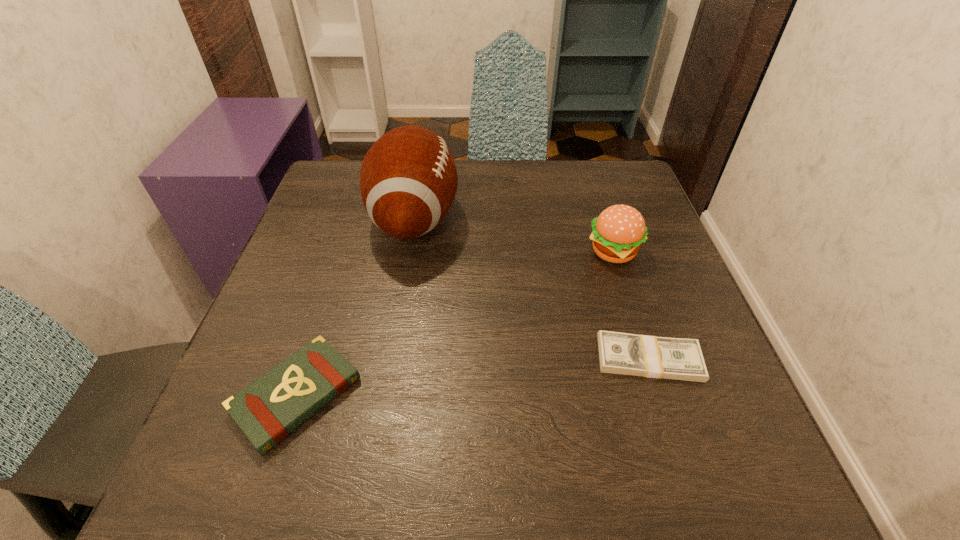
This screenshot has height=540, width=960. Identify the location of free space that satisfies the following two spatial constraints: 1. on the back side of the second tallest object; 2. on the left side of the book. (344, 252).